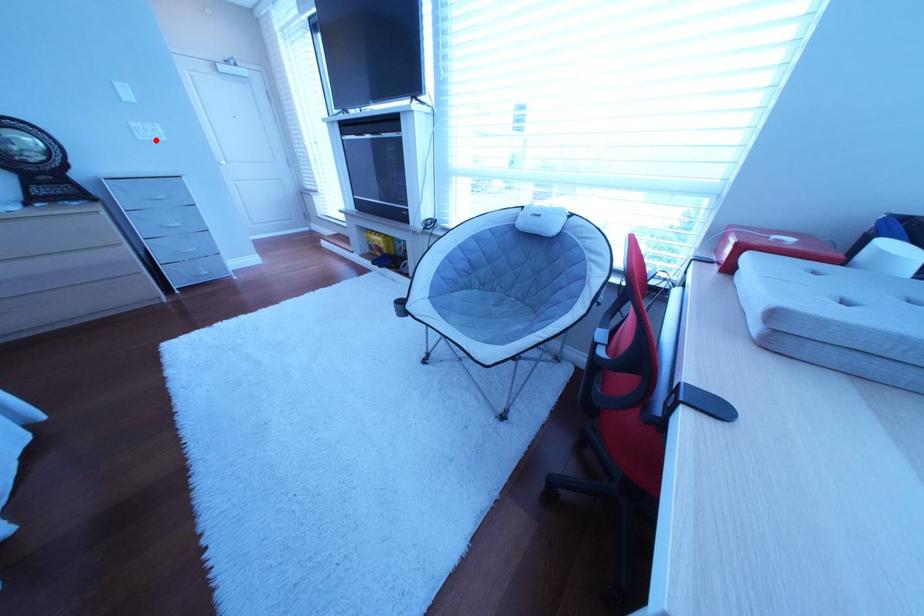
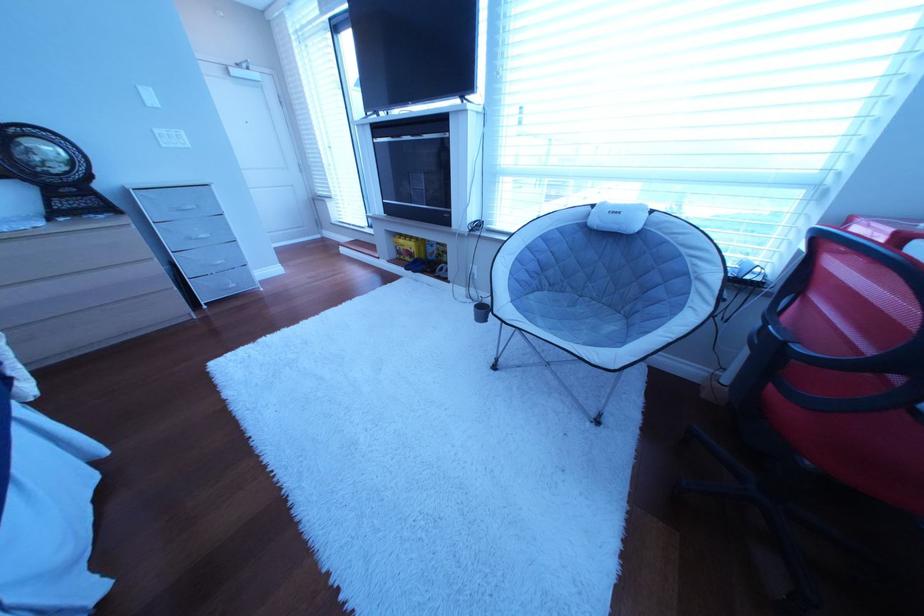
Where in the second image is the point corresponding to the highlighted location from the first image?

(179, 148)